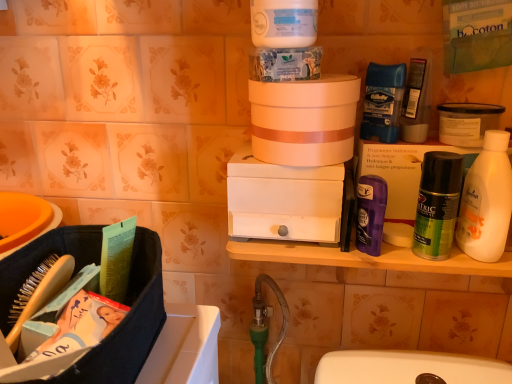
Question: Does blue paper towel at upper center, the first product from the top, have a larger size compared to white matte jar at upper center?

Choices:
 (A) yes
 (B) no

Answer: (B)

Question: Are blue paper towel at upper center, the second product viewed from the right, and white matte jar at upper center beside each other?

Choices:
 (A) yes
 (B) no

Answer: (A)

Question: From a real-world perspective, does blue paper towel at upper center, the first product from the top, sit lower than white matte jar at upper center?

Choices:
 (A) yes
 (B) no

Answer: (A)

Question: Can you confirm if blue paper towel at upper center, the first product from the top, is thinner than white matte jar at upper center?

Choices:
 (A) no
 (B) yes

Answer: (B)

Question: Is blue paper towel at upper center, acting as the first product starting from the left, at the right side of white matte jar at upper center?

Choices:
 (A) no
 (B) yes

Answer: (A)

Question: Can you confirm if blue paper towel at upper center, the first product from the top, is smaller than white matte jar at upper center?

Choices:
 (A) no
 (B) yes

Answer: (B)

Question: From a real-world perspective, is white matte drawer at center, which is the 1th box from left to right, positioned over blue paper towel at upper center, the second product viewed from the right, based on gravity?

Choices:
 (A) no
 (B) yes

Answer: (A)

Question: Is white matte drawer at center, the second box positioned from the right, not close to blue paper towel at upper center, the second product viewed from the right?

Choices:
 (A) yes
 (B) no

Answer: (B)

Question: Is white matte drawer at center, which is the 1th box from left to right, beside blue paper towel at upper center, arranged as the 2th product when ordered from the bottom?

Choices:
 (A) no
 (B) yes

Answer: (A)

Question: Considering the relative sizes of white matte drawer at center, which is the 1th box from left to right, and blue paper towel at upper center, the second product viewed from the right, in the image provided, is white matte drawer at center, which is the 1th box from left to right, taller than blue paper towel at upper center, the second product viewed from the right,?

Choices:
 (A) no
 (B) yes

Answer: (B)

Question: Considering the relative positions of white matte drawer at center, which is the 1th box from left to right, and blue paper towel at upper center, the first product from the top, in the image provided, is white matte drawer at center, which is the 1th box from left to right, to the right of blue paper towel at upper center, the first product from the top, from the viewer's perspective?

Choices:
 (A) no
 (B) yes

Answer: (B)

Question: From a real-world perspective, is white matte drawer at center, the second box positioned from the right, positioned under blue paper towel at upper center, arranged as the 2th product when ordered from the bottom, based on gravity?

Choices:
 (A) yes
 (B) no

Answer: (A)

Question: From a real-world perspective, is blue paper towel at upper center, acting as the first product starting from the left, positioned under white matte drawer at center, the second box positioned from the right, based on gravity?

Choices:
 (A) no
 (B) yes

Answer: (A)